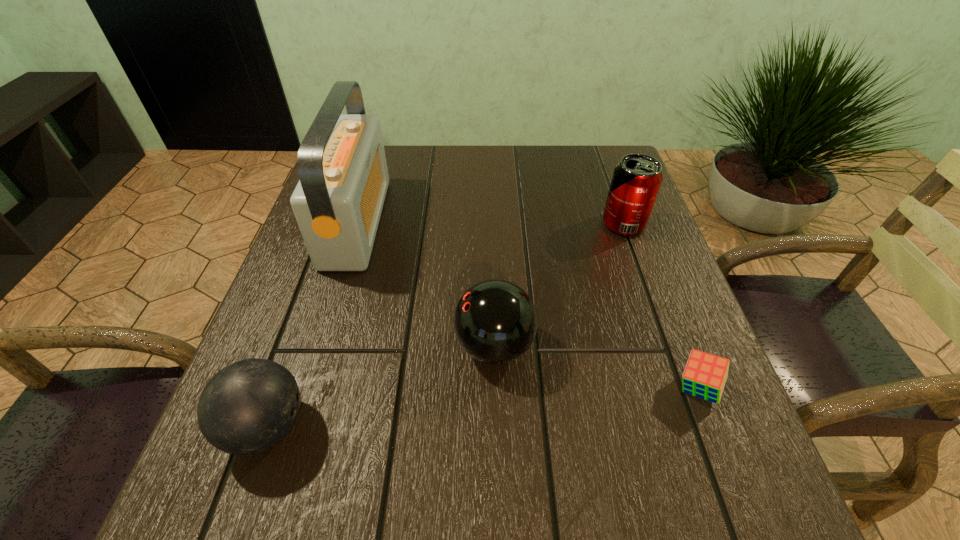
Find the location of `blank space that satisfies the following two spatial constraints: 1. on the back side of the cube; 2. on the front-facing side of the tallest object`. blank space that satisfies the following two spatial constraints: 1. on the back side of the cube; 2. on the front-facing side of the tallest object is located at coordinates (634, 222).

Where is `free region that satisfies the following two spatial constraints: 1. on the back side of the cube; 2. on the surface of the right bowling ball near the finger holes`? Image resolution: width=960 pixels, height=540 pixels. free region that satisfies the following two spatial constraints: 1. on the back side of the cube; 2. on the surface of the right bowling ball near the finger holes is located at coordinates (681, 346).